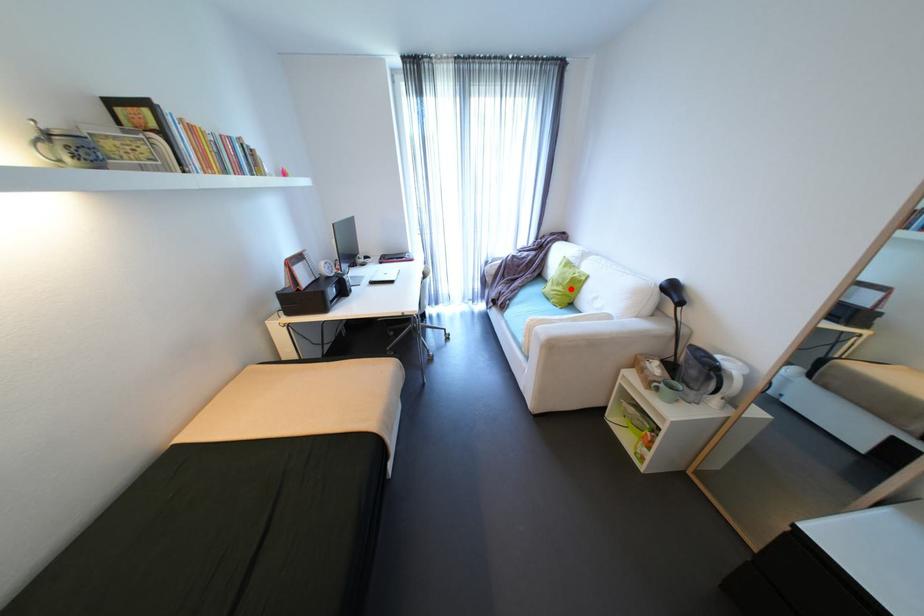
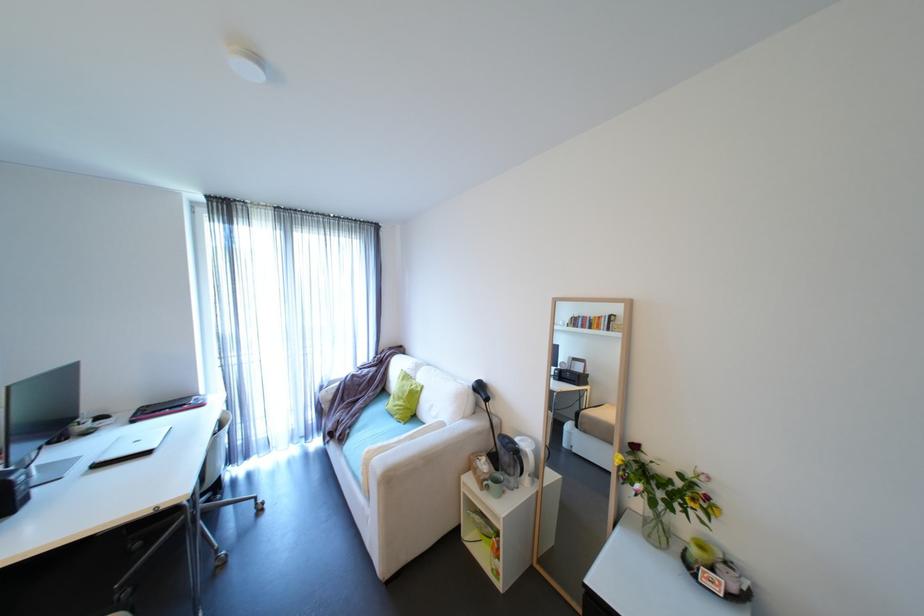
Find the pixel in the second image that matches the highlighted location in the first image.

(411, 402)